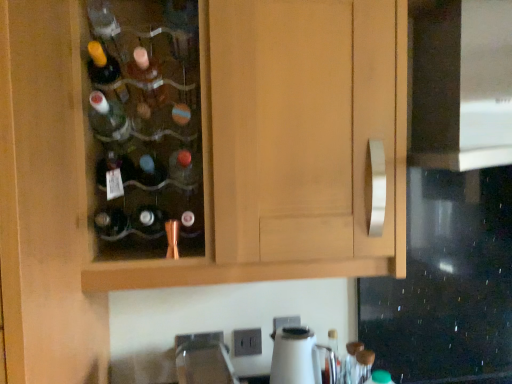
Question: Is satin nickel faucet at lower center positioned far away from wooden cabinet at center?

Choices:
 (A) yes
 (B) no

Answer: (B)

Question: Can you confirm if satin nickel faucet at lower center is shorter than wooden cabinet at center?

Choices:
 (A) no
 (B) yes

Answer: (B)

Question: Is satin nickel faucet at lower center located outside wooden cabinet at center?

Choices:
 (A) no
 (B) yes

Answer: (B)

Question: From a real-world perspective, is satin nickel faucet at lower center positioned over wooden cabinet at center based on gravity?

Choices:
 (A) no
 (B) yes

Answer: (A)

Question: Considering the relative sizes of satin nickel faucet at lower center and wooden cabinet at center in the image provided, is satin nickel faucet at lower center taller than wooden cabinet at center?

Choices:
 (A) yes
 (B) no

Answer: (B)

Question: Can you confirm if satin nickel faucet at lower center is bigger than wooden cabinet at center?

Choices:
 (A) no
 (B) yes

Answer: (A)

Question: Is matte glass bottle at center shorter than satin nickel faucet at lower center?

Choices:
 (A) no
 (B) yes

Answer: (B)

Question: Is matte glass bottle at center taller than satin nickel faucet at lower center?

Choices:
 (A) yes
 (B) no

Answer: (B)

Question: Does matte glass bottle at center have a greater width compared to satin nickel faucet at lower center?

Choices:
 (A) no
 (B) yes

Answer: (B)

Question: From the image's perspective, is matte glass bottle at center beneath satin nickel faucet at lower center?

Choices:
 (A) yes
 (B) no

Answer: (B)

Question: Is there a large distance between matte glass bottle at center and satin nickel faucet at lower center?

Choices:
 (A) yes
 (B) no

Answer: (B)

Question: From a real-world perspective, is matte glass bottle at center physically below satin nickel faucet at lower center?

Choices:
 (A) no
 (B) yes

Answer: (A)

Question: From a real-world perspective, is black glass oven at right positioned under matte glass bottle at center based on gravity?

Choices:
 (A) no
 (B) yes

Answer: (A)